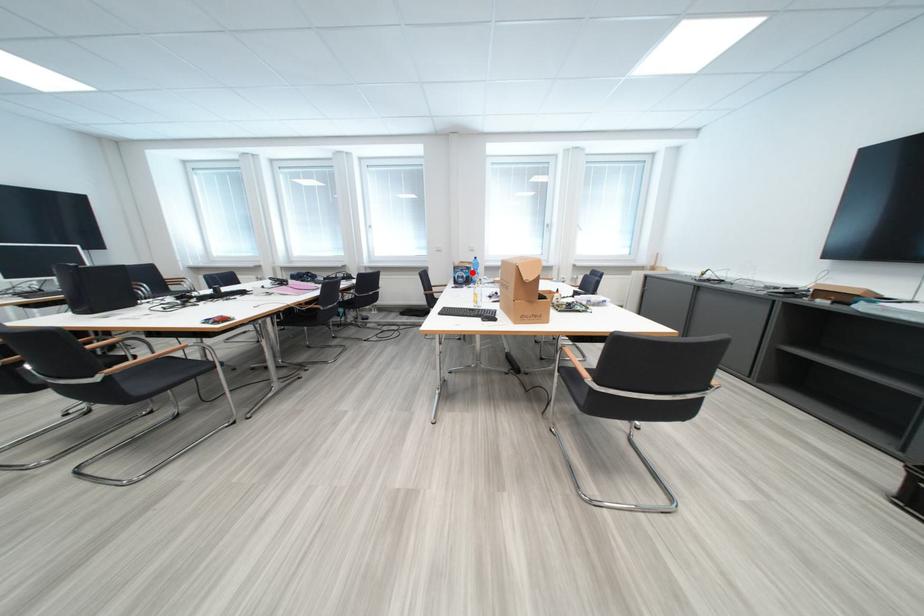
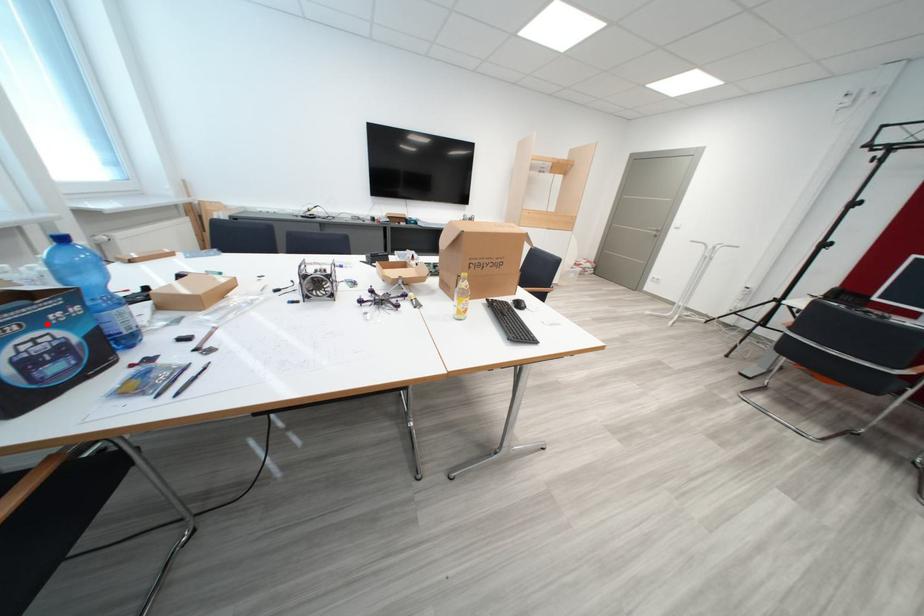
I am providing you with two images of the same scene from different viewpoints. A red point is marked on the first image and another point is marked on the second image. Do the highlighted points in image1 and image2 indicate the same real-world spot?

Yes